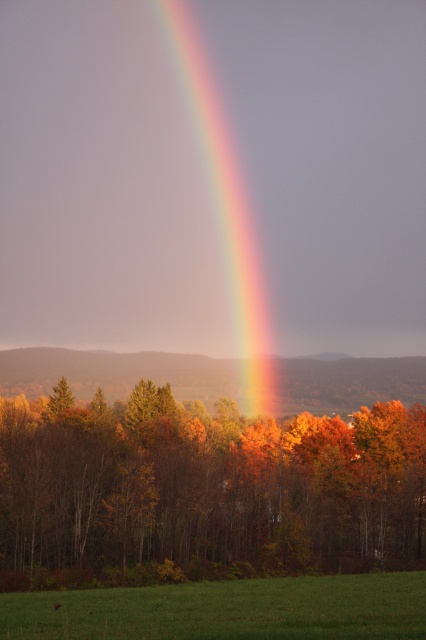
You are standing in the forest looking up at the rainbow. There are two points marked in the image. One is at coordinate point (412, 528) and the other is at point (71, 602). Which point is closer to you?

Point (412, 528) is further to the viewer than point (71, 602), so the closer point to you is point (71, 602).

You are a painter wanting to capture the landscape. You notice the green grass at lower center and the rainbow at center. Which object would you need to paint with more detail due to its size?

The rainbow at center requires more detail because it is wider than the green grass at lower center.

You are standing in the forest looking up at the rainbow. There is a point marked at coordinates (203, 490) in the image. What is located at this point?

The point marked at coordinates (203, 490) in the image is autumn leaves at center.